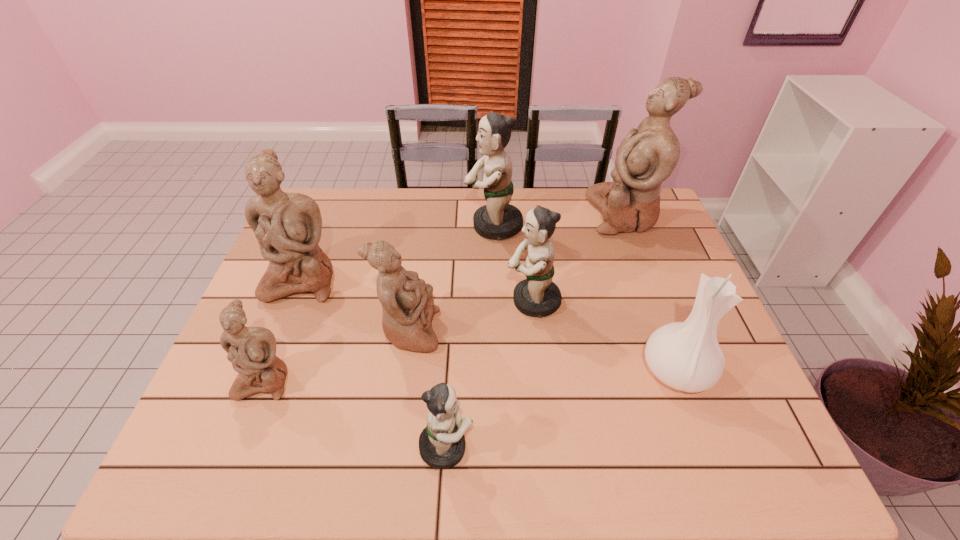
Find the location of a particular element. the tallest figurine is located at coordinates (646, 157).

Find the location of a particular element. The height and width of the screenshot is (540, 960). the rightmost figurine is located at coordinates (646, 157).

Identify the location of the biggest green figurine. (497, 219).

Locate an element on the screen. the second biggest white figurine is located at coordinates (288, 226).

Find the location of a particular element. The height and width of the screenshot is (540, 960). the second smallest green figurine is located at coordinates (537, 296).

Find the location of a particular element. The image size is (960, 540). the second white figurine from right to left is located at coordinates (407, 302).

You are a GUI agent. You are given a task and a screenshot of the screen. Output one action in this format:
    pyautogui.click(x=<x>, y=<y>)
    Task: Click on the third biggest white figurine
    
    Given the screenshot: What is the action you would take?
    pyautogui.click(x=407, y=302)

At what (x,y) coordinates should I click in order to perform the action: click on vase. Please return your answer as a coordinate pair (x, y). Looking at the image, I should click on (686, 356).

Locate an element on the screen. The image size is (960, 540). the sixth farthest figurine is located at coordinates (252, 350).

Identify the location of the smallest white figurine. (252, 350).